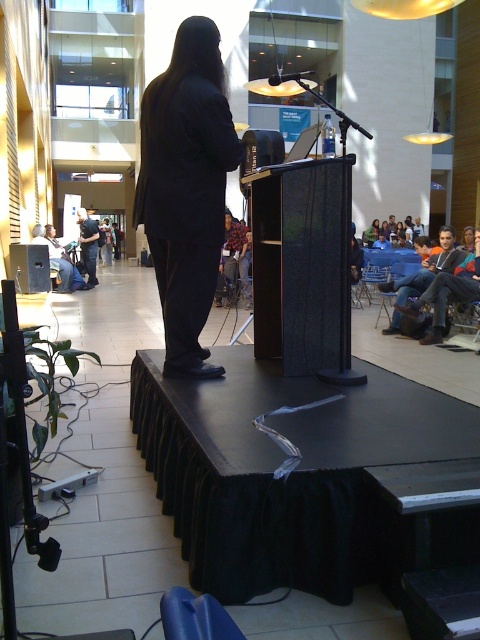
From the picture: You are a photographer positioned at the back of the conference hall. You want to take a photo of the blue jeans at center and denim jacket at center so that both are in the frame. Given that your camera has a maximum focus range of 25 feet, can you capture both items clearly in the same photo?

The blue jeans at center and denim jacket at center are 25.11 feet apart. Since the distance between them exceeds the camera maximum focus range of 25 feet, you cannot capture both items clearly in the same photo.

You are an event organizer who needs to adjust the seating arrangement for a photoshoot. You see the blue jeans at center and the flannel shirt at center. Which clothing item should you move upward to ensure proper visibility for both items?

The blue jeans at center has a lesser height compared to flannel shirt at center, so you should move the blue jeans at center upward to ensure proper visibility for both items.